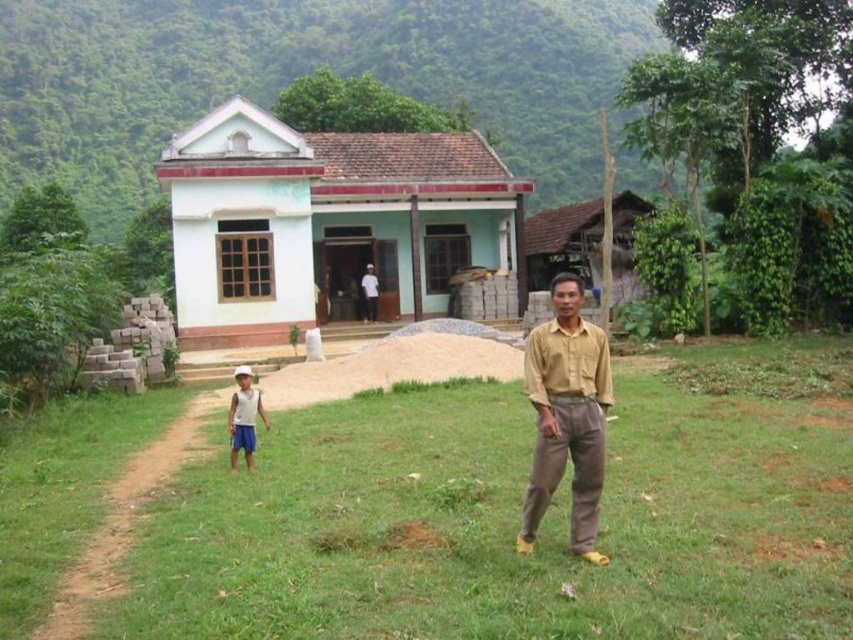
Question: Is green grass at center smaller than yellow cotton shirt at center?

Choices:
 (A) no
 (B) yes

Answer: (A)

Question: Does yellow cotton shirt at center come in front of rustic wooden hut at right?

Choices:
 (A) yes
 (B) no

Answer: (A)

Question: Among these points, which one is farthest from the camera?

Choices:
 (A) (302, 321)
 (B) (374, 312)
 (C) (527, 497)
 (D) (738, 605)

Answer: (B)

Question: Is rustic wooden hut at right to the right of light brown shirt at center from the viewer's perspective?

Choices:
 (A) no
 (B) yes

Answer: (B)

Question: Considering the real-world distances, which object is closest to the light blue painted wood house at center?

Choices:
 (A) light brown shirt at center
 (B) green grass at center
 (C) rustic wooden hut at right

Answer: (A)

Question: Considering the real-world distances, which object is farthest from the yellow cotton shirt at center?

Choices:
 (A) rustic wooden hut at right
 (B) light blue painted wood house at center
 (C) light brown shirt at center

Answer: (A)